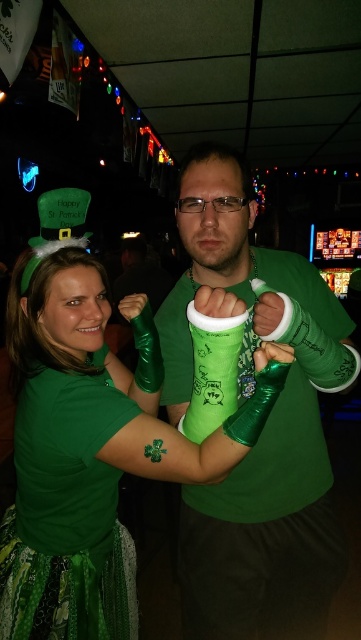
Question: Which object is farther from the camera taking this photo?

Choices:
 (A) matte green shirt at center
 (B) shiny green arm bands at center
 (C) green matte t-shirt at left

Answer: (C)

Question: Is shiny green arm bands at center positioned at the back of green matte t-shirt at left?

Choices:
 (A) no
 (B) yes

Answer: (A)

Question: Which point is farther from the camera taking this photo?

Choices:
 (A) (6, 522)
 (B) (315, 275)

Answer: (A)

Question: Does matte green shirt at center have a lesser width compared to shiny green arm bands at center?

Choices:
 (A) no
 (B) yes

Answer: (A)

Question: Estimate the real-world distances between objects in this image. Which object is farther from the shiny green arm bands at center?

Choices:
 (A) matte green shirt at center
 (B) green matte t-shirt at left

Answer: (B)

Question: Can you confirm if matte green shirt at center is positioned to the left of shiny green arm bands at center?

Choices:
 (A) yes
 (B) no

Answer: (A)